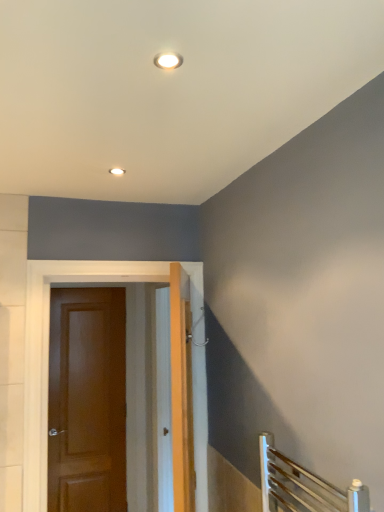
Where is `matte brown door at left, positioned as the first door in back-to-front order`? matte brown door at left, positioned as the first door in back-to-front order is located at coordinates (87, 400).

In order to click on matte white recessed light at upper center in this screenshot , I will do `click(117, 170)`.

Locate an element on the screen. The image size is (384, 512). brown wooden door at center, which appears as the first door when viewed from the front is located at coordinates (48, 354).

Find the location of a particular element. the 2nd door behind the matte white recessed light at upper center, starting your count from the anchor is located at coordinates (87, 400).

Is matte brown door at left, positioned as the first door in back-to-front order, turned away from matte white recessed light at upper center?

matte brown door at left, positioned as the first door in back-to-front order, does not have its back to matte white recessed light at upper center.

Which object is positioned more to the left, matte brown door at left, positioned as the second door in right-to-left order, or matte white recessed light at upper center?

matte brown door at left, positioned as the second door in right-to-left order.

Is matte brown door at left, positioned as the second door in right-to-left order, not near matte white recessed light at upper center?

That's right, there is a large distance between matte brown door at left, positioned as the second door in right-to-left order, and matte white recessed light at upper center.

Does matte white recessed light at upper center turn towards brown wooden door at center, the 2th door viewed from the back?

No, matte white recessed light at upper center is not oriented towards brown wooden door at center, the 2th door viewed from the back.

Looking at their sizes, would you say matte white recessed light at upper center is wider or thinner than brown wooden door at center, the 2th door viewed from the back?

In the image, matte white recessed light at upper center appears to be more narrow than brown wooden door at center, the 2th door viewed from the back.

Image resolution: width=384 pixels, height=512 pixels. Find the location of `lighting above the brown wooden door at center, the 2th door viewed from the back (from the image's perspective)`. lighting above the brown wooden door at center, the 2th door viewed from the back (from the image's perspective) is located at coordinates (117, 170).

From the image's perspective, would you say matte brown door at left, which appears as the first door when viewed from the left, is positioned over brown wooden door at center, the 1th door from the right?

Incorrect, from the image's perspective, matte brown door at left, which appears as the first door when viewed from the left, is lower than brown wooden door at center, the 1th door from the right.

Can you confirm if matte brown door at left, positioned as the first door in back-to-front order, is thinner than brown wooden door at center, which appears as the first door when viewed from the front?

Yes, matte brown door at left, positioned as the first door in back-to-front order, is thinner than brown wooden door at center, which appears as the first door when viewed from the front.

Is matte brown door at left, which appears as the first door when viewed from the left, turned away from brown wooden door at center, the 2th door viewed from the back?

That's not correct — matte brown door at left, which appears as the first door when viewed from the left, is not looking away from brown wooden door at center, the 2th door viewed from the back.

Considering the sizes of objects matte brown door at left, positioned as the second door in right-to-left order, and brown wooden door at center, arranged as the second door when viewed from the left, in the image provided, who is smaller, matte brown door at left, positioned as the second door in right-to-left order, or brown wooden door at center, arranged as the second door when viewed from the left,?

With smaller size is matte brown door at left, positioned as the second door in right-to-left order.

From the image's perspective, does brown wooden door at center, the 1th door from the right, appear lower than matte brown door at left, positioned as the second door in right-to-left order?

Incorrect, from the image's perspective, brown wooden door at center, the 1th door from the right, is higher than matte brown door at left, positioned as the second door in right-to-left order.

Is brown wooden door at center, which appears as the first door when viewed from the front, to the right of matte brown door at left, the second door viewed from the front, from the viewer's perspective?

Indeed, brown wooden door at center, which appears as the first door when viewed from the front, is positioned on the right side of matte brown door at left, the second door viewed from the front.

How many degrees apart are the facing directions of brown wooden door at center, the 1th door from the right, and matte brown door at left, positioned as the second door in right-to-left order?

0.626 degrees separate the facing orientations of brown wooden door at center, the 1th door from the right, and matte brown door at left, positioned as the second door in right-to-left order.

Which of these two, brown wooden door at center, the 2th door viewed from the back, or matte brown door at left, which appears as the first door when viewed from the left, is thinner?

With smaller width is matte brown door at left, which appears as the first door when viewed from the left.

From the image's perspective, is brown wooden door at center, the 1th door from the right, located beneath matte white recessed light at upper center?

Correct, brown wooden door at center, the 1th door from the right, appears lower than matte white recessed light at upper center in the image.

Where is `lighting that is above the brown wooden door at center, arranged as the second door when viewed from the left (from the image's perspective)`? The width and height of the screenshot is (384, 512). lighting that is above the brown wooden door at center, arranged as the second door when viewed from the left (from the image's perspective) is located at coordinates tap(117, 170).

Between brown wooden door at center, the 1th door from the right, and matte white recessed light at upper center, which one has smaller size?

matte white recessed light at upper center.

Looking at the image, does matte white recessed light at upper center seem bigger or smaller compared to matte brown door at left, positioned as the second door in right-to-left order?

In the image, matte white recessed light at upper center appears to be smaller than matte brown door at left, positioned as the second door in right-to-left order.

Would you say matte white recessed light at upper center is a long distance from matte brown door at left, the second door viewed from the front?

Indeed, matte white recessed light at upper center is not near matte brown door at left, the second door viewed from the front.

Between point (111, 172) and point (51, 486), which one is positioned in front?

The point (111, 172) is closer.

Find the location of a particular element. The image size is (384, 512). lighting above the matte brown door at left, positioned as the first door in back-to-front order (from the image's perspective) is located at coordinates (117, 170).

From the matte white recessed light at upper center, count the 2nd door to the left and point to it. Please provide its 2D coordinates.

[(87, 400)]

Find the location of a particular element. This screenshot has height=512, width=384. the 1st door behind the matte white recessed light at upper center is located at coordinates [x=48, y=354].

Considering their positions, is matte white recessed light at upper center positioned further to brown wooden door at center, the 2th door viewed from the back, than matte brown door at left, the second door viewed from the front?

matte brown door at left, the second door viewed from the front, is positioned further to the anchor brown wooden door at center, the 2th door viewed from the back.

From the image, which object appears to be nearer to matte brown door at left, positioned as the second door in right-to-left order, brown wooden door at center, which appears as the first door when viewed from the front, or matte white recessed light at upper center?

brown wooden door at center, which appears as the first door when viewed from the front, is positioned closer to the anchor matte brown door at left, positioned as the second door in right-to-left order.

Estimate the real-world distances between objects in this image. Which object is further from brown wooden door at center, which appears as the first door when viewed from the front, matte brown door at left, positioned as the second door in right-to-left order, or matte white recessed light at upper center?

matte brown door at left, positioned as the second door in right-to-left order.

Estimate the real-world distances between objects in this image. Which object is closer to matte brown door at left, positioned as the first door in back-to-front order, matte white recessed light at upper center or brown wooden door at center, the 1th door from the right?

The object closer to matte brown door at left, positioned as the first door in back-to-front order, is brown wooden door at center, the 1th door from the right.

Based on their spatial positions, is brown wooden door at center, the 2th door viewed from the back, or matte brown door at left, the second door viewed from the front, further from matte white recessed light at upper center?

matte brown door at left, the second door viewed from the front, is further to matte white recessed light at upper center.

Estimate the real-world distances between objects in this image. Which object is closer to matte white recessed light at upper center, matte brown door at left, the second door viewed from the front, or brown wooden door at center, the 1th door from the right?

Among the two, brown wooden door at center, the 1th door from the right, is located nearer to matte white recessed light at upper center.

Find the location of a particular element. door between matte white recessed light at upper center and matte brown door at left, the second door viewed from the front, in the front-back direction is located at coordinates (48, 354).